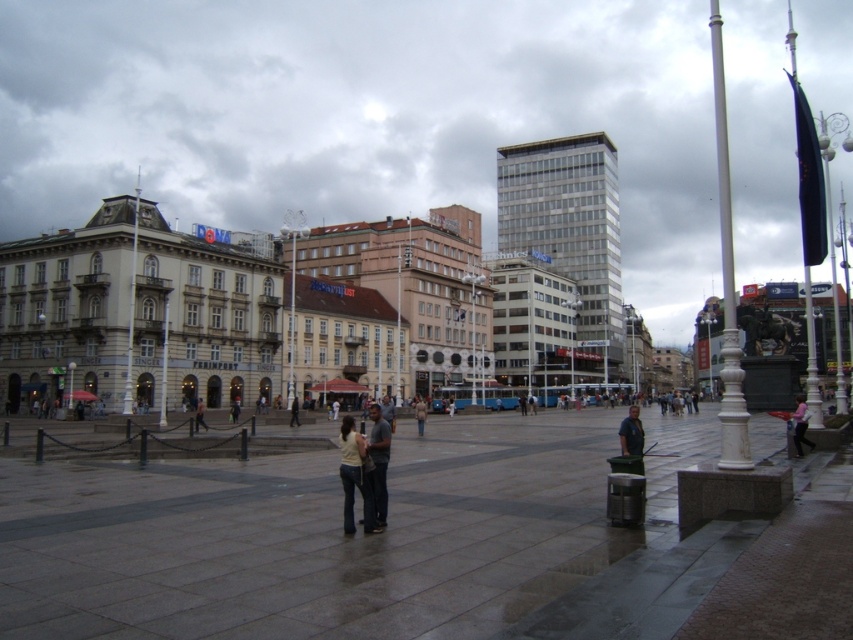
Where is `light beige jeans at center`? light beige jeans at center is located at coordinates (364, 472).

Where is `light beige jeans at center`? The height and width of the screenshot is (640, 853). light beige jeans at center is located at coordinates (364, 472).

Does dark gray jeans at center have a greater width compared to dark gray pants at center?

Yes, dark gray jeans at center is wider than dark gray pants at center.

Who is positioned more to the left, dark gray jeans at center or dark gray pants at center?

From the viewer's perspective, dark gray jeans at center appears more on the left side.

Describe the element at coordinates (199, 416) in the screenshot. I see `dark gray jeans at center` at that location.

Where is `dark gray jeans at center`? dark gray jeans at center is located at coordinates (199, 416).

Which is in front, point (798, 436) or point (421, 413)?

Positioned in front is point (798, 436).

Looking at this image, can you confirm if pink fabric at lower right is smaller than light beige coat at center?

Actually, pink fabric at lower right might be larger than light beige coat at center.

Who is more forward, (x=805, y=419) or (x=426, y=406)?

Point (x=805, y=419)

This screenshot has width=853, height=640. Find the location of `pink fabric at lower right`. pink fabric at lower right is located at coordinates (799, 424).